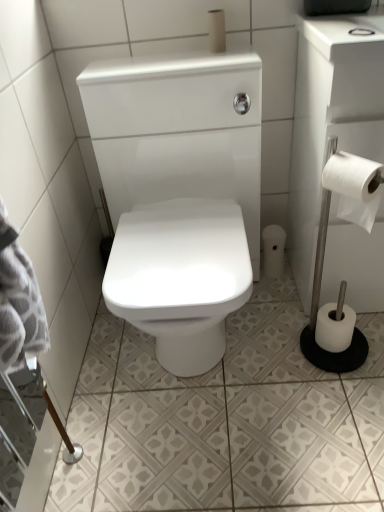
The image size is (384, 512). I want to click on vacant area that lies between white glossy toilet at center and white paper roll at lower right, the third toilet paper from the top, so click(275, 317).